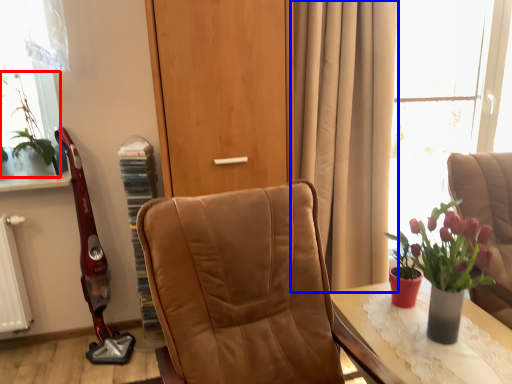
Question: Which object appears farthest to the camera in this image, houseplant (highlighted by a red box) or curtain (highlighted by a blue box)?

Choices:
 (A) houseplant
 (B) curtain

Answer: (A)